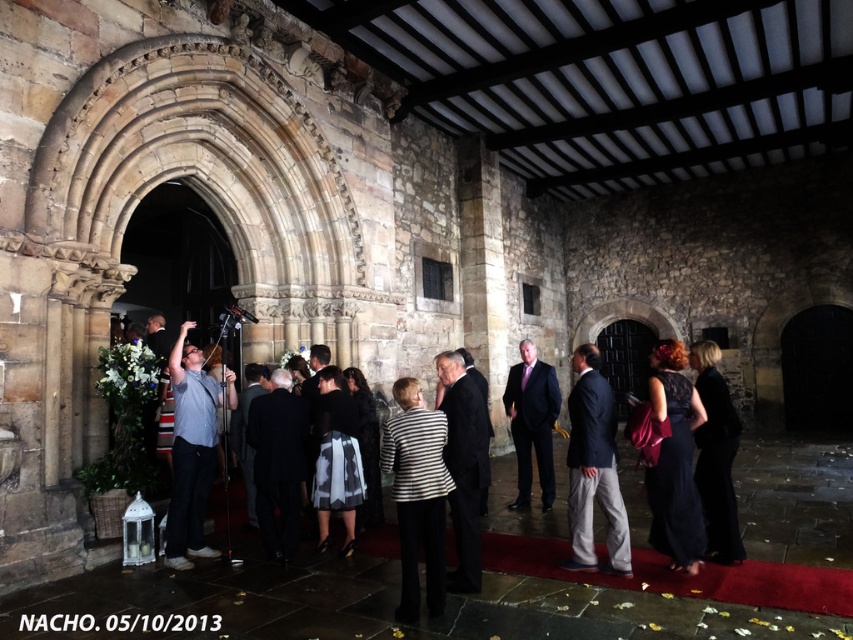
Does smooth stone steps at center lie behind matte black suit at center?

No, it is in front of matte black suit at center.

This screenshot has height=640, width=853. Identify the location of smooth stone steps at center. (606, 586).

Between velvet black dress at center and gray fabric shirt at center, which one has more height?

With more height is velvet black dress at center.

What do you see at coordinates (674, 461) in the screenshot?
I see `velvet black dress at center` at bounding box center [674, 461].

Locate an element on the screen. The height and width of the screenshot is (640, 853). velvet black dress at center is located at coordinates click(x=674, y=461).

Does dark gray suit at center have a smaller size compared to silky black dress at center?

No.

Is point (460, 396) positioned after point (317, 515)?

No, it is in front of (317, 515).

Find the location of a particular element. This screenshot has height=640, width=853. dark gray suit at center is located at coordinates (463, 465).